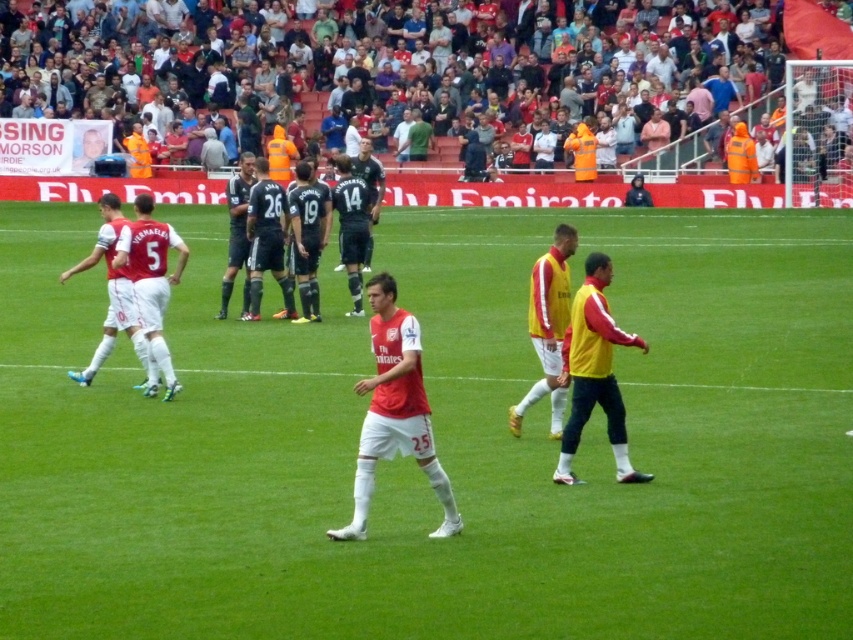
From the picture: Is matte red jersey at center thinner than white matte jersey at left?

No.

Does matte red jersey at center appear under white matte jersey at left?

Correct, matte red jersey at center is located below white matte jersey at left.

Does point (456, 522) come farther from viewer compared to point (123, 262)?

No, it is in front of (123, 262).

Find the location of `matte red jersey at center`. matte red jersey at center is located at coordinates (393, 412).

Is green grass football field at center closer to the viewer compared to matte red jersey at center?

That is True.

Between point (480, 509) and point (440, 492), which one is positioned in front?

Positioned in front is point (440, 492).

Does point (312, 561) lie behind point (393, 314)?

No, (312, 561) is in front of (393, 314).

Find the location of a particular element. green grass football field at center is located at coordinates (438, 442).

Does matte red jersey at center have a lesser width compared to yellow/yellowish fabric jacket at right?

Incorrect, matte red jersey at center's width is not less than yellow/yellowish fabric jacket at right's.

Can you confirm if matte red jersey at center is taller than yellow/yellowish fabric jacket at right?

Incorrect, matte red jersey at center's height is not larger of yellow/yellowish fabric jacket at right's.

Identify the location of matte red jersey at center. (393, 412).